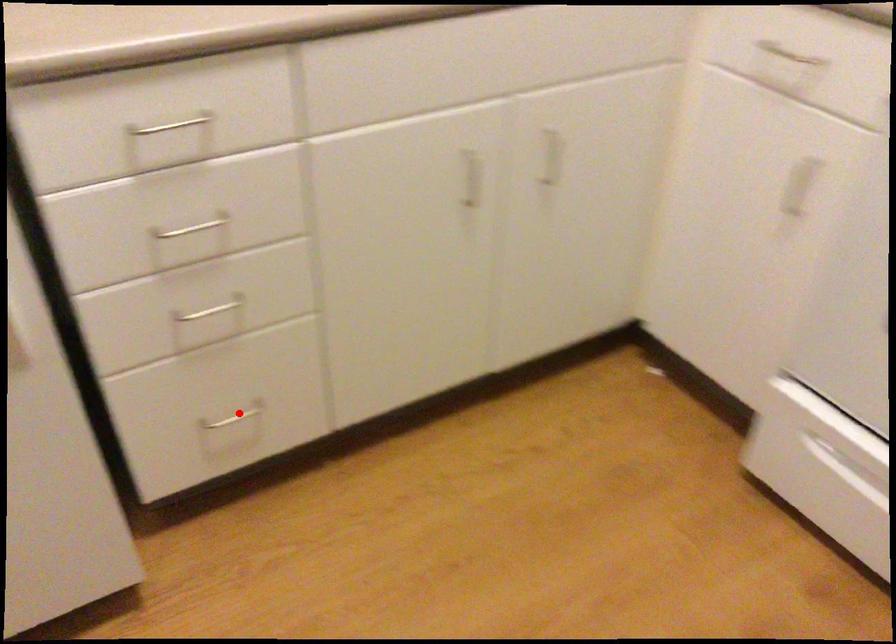
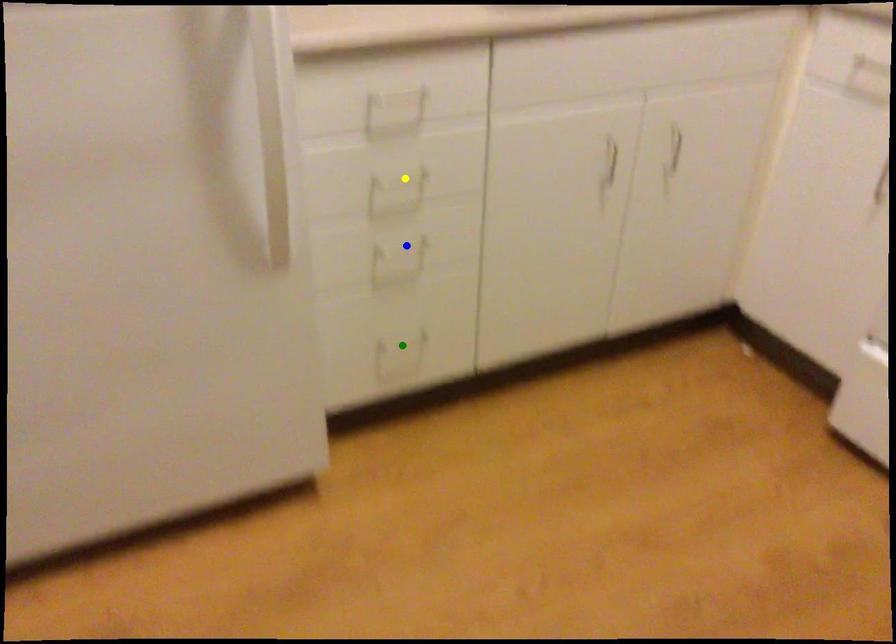
Question: I am providing you with two images of the same scene from different viewpoints. A red point is marked on the first image. You are given multiple points on the second image. Which point in image 2 represents the same 3d spot as the red point in image 1?

Choices:
 (A) blue point
 (B) green point
 (C) yellow point

Answer: (B)